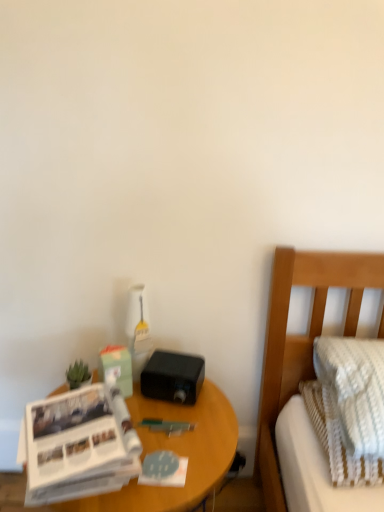
Question: Considering their positions, is white textured mattress at right located in front of or behind green matte plant at left?

Choices:
 (A) front
 (B) behind

Answer: (A)

Question: Is point (301, 485) positioned closer to the camera than point (87, 380)?

Choices:
 (A) farther
 (B) closer

Answer: (B)

Question: Based on their relative distances, which object is farther from the white textured mattress at right?

Choices:
 (A) wooden nightstand at lower left
 (B) green matte plant at left
 (C) white paper at left
 (D) textured beige pillow at right

Answer: (B)

Question: Which object is the farthest from the green matte plant at left?

Choices:
 (A) white textured mattress at right
 (B) wooden nightstand at lower left
 (C) white paper at left
 (D) textured beige pillow at right

Answer: (D)